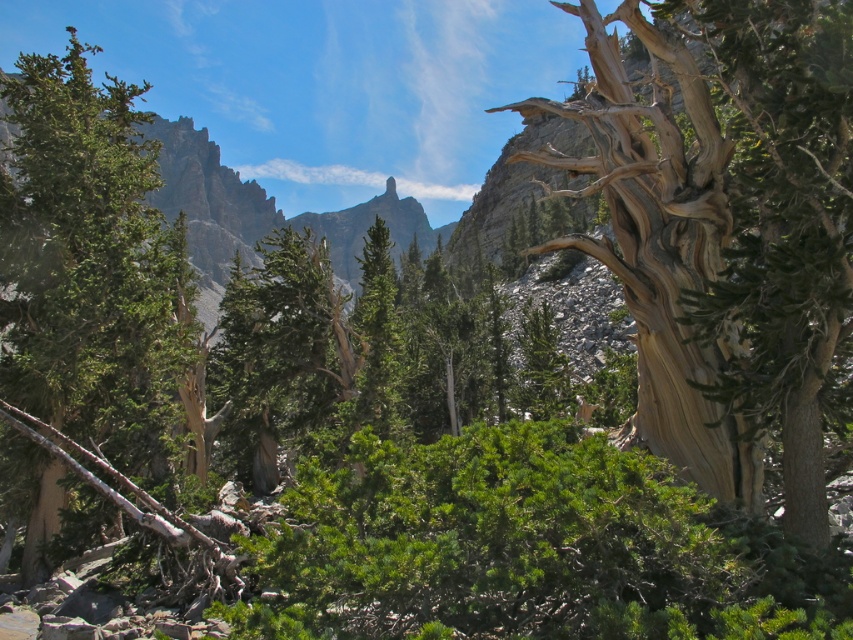
Does gray textured bark tree at center have a lesser width compared to green rough bark tree at left?

Correct, gray textured bark tree at center's width is less than green rough bark tree at left's.

Can you confirm if gray textured bark tree at center is wider than green rough bark tree at left?

No, gray textured bark tree at center is not wider than green rough bark tree at left.

Locate an element on the screen. gray textured bark tree at center is located at coordinates (726, 234).

Is green rough bark tree at left behind green rock at upper center?

No, green rough bark tree at left is in front of green rock at upper center.

In the scene shown: Who is positioned more to the left, green rough bark tree at left or green rock at upper center?

green rock at upper center

Identify the location of green rough bark tree at left. The image size is (853, 640). (86, 262).

Which is in front, point (641, 305) or point (207, 252)?

Point (641, 305) is in front.

Does gray textured bark tree at center appear on the left side of green rock at upper center?

In fact, gray textured bark tree at center is to the right of green rock at upper center.

Between point (785, 461) and point (212, 282), which one is positioned behind?

The point (212, 282) is behind.

The width and height of the screenshot is (853, 640). Identify the location of gray textured bark tree at center. (726, 234).